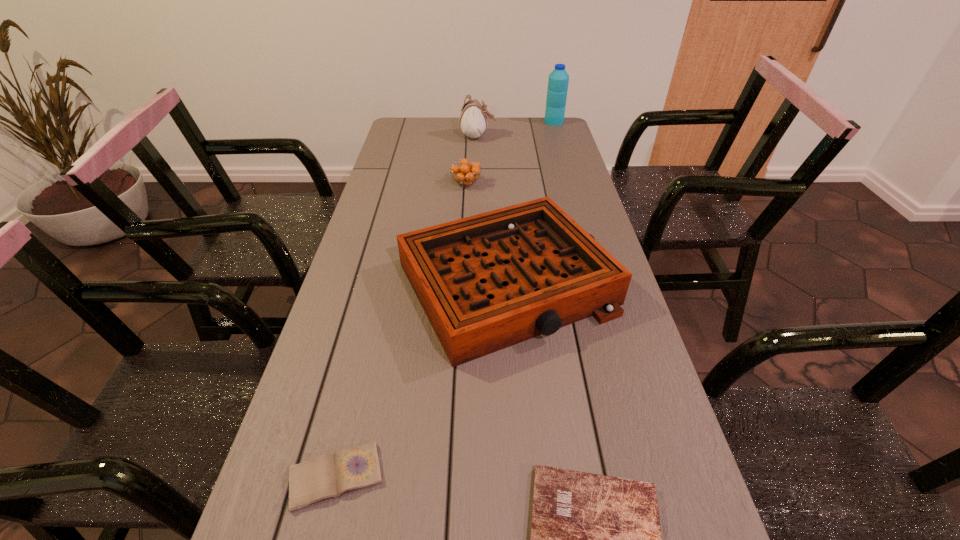
Find the location of a particular element. object at the far right corner is located at coordinates (558, 80).

You are a GUI agent. You are given a task and a screenshot of the screen. Output one action in this format:
    pyautogui.click(x=<x>, y=<y>)
    Task: Click on the vacant space at the far edge of the desktop
    
    Given the screenshot: What is the action you would take?
    point(448,119)

You are a GUI agent. You are given a task and a screenshot of the screen. Output one action in this format:
    pyautogui.click(x=<x>, y=<y>)
    Task: Click on the vacant space at the left edge
    
    Given the screenshot: What is the action you would take?
    pyautogui.click(x=395, y=284)

The height and width of the screenshot is (540, 960). Identify the location of vacant position at the right edge of the desktop. (557, 170).

I want to click on vacant space at the far right corner of the desktop, so click(543, 129).

Identify the location of free spot between the orange fruit and the second tallest object. (471, 160).

This screenshot has width=960, height=540. What are the coordinates of `empty space between the farthest object and the orange fruit` in the screenshot? It's located at (510, 153).

At what (x,y) coordinates should I click in order to perform the action: click on free spot between the second farthest object and the fifth tallest object. Please return your answer as a coordinate pair (x, y). The width and height of the screenshot is (960, 540). Looking at the image, I should click on (407, 307).

This screenshot has height=540, width=960. Find the location of `empty space that is in between the diary and the fourth farthest object`. empty space that is in between the diary and the fourth farthest object is located at coordinates (421, 380).

Where is `free space between the fourth farthest object and the diary`? This screenshot has height=540, width=960. free space between the fourth farthest object and the diary is located at coordinates (421, 380).